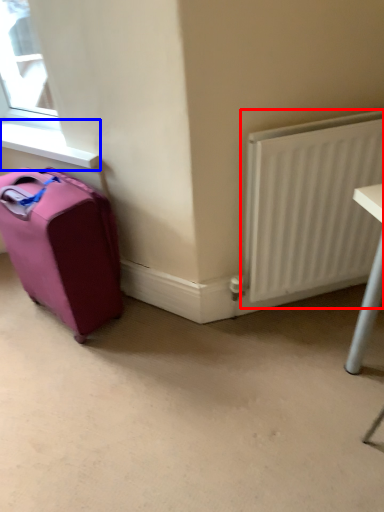
Question: Which of the following is the closest to the observer, radiator (highlighted by a red box) or window sill (highlighted by a blue box)?

Choices:
 (A) radiator
 (B) window sill

Answer: (A)